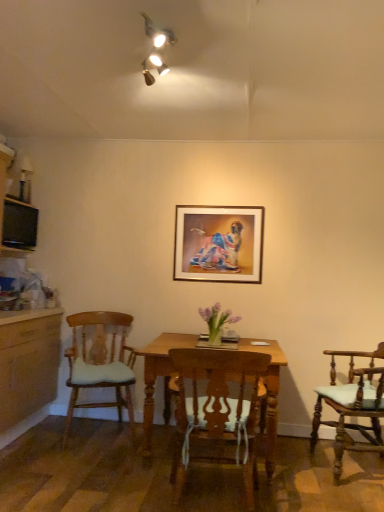
Question: Is gold-framed picture at center not within wooden chair with cushion at right, acting as the third chair starting from the left?

Choices:
 (A) no
 (B) yes

Answer: (B)

Question: Is wooden chair with cushion at right, which is the 1th chair from right to left, surrounded by gold-framed picture at center?

Choices:
 (A) yes
 (B) no

Answer: (B)

Question: Can you confirm if gold-framed picture at center is smaller than wooden chair with cushion at right, which is the 1th chair from right to left?

Choices:
 (A) no
 (B) yes

Answer: (B)

Question: Considering the relative sizes of gold-framed picture at center and wooden chair with cushion at right, acting as the third chair starting from the left, in the image provided, is gold-framed picture at center thinner than wooden chair with cushion at right, acting as the third chair starting from the left,?

Choices:
 (A) no
 (B) yes

Answer: (B)

Question: Does gold-framed picture at center have a lesser height compared to wooden chair with cushion at right, acting as the third chair starting from the left?

Choices:
 (A) no
 (B) yes

Answer: (B)

Question: Is gold-framed picture at center further to camera compared to wooden chair with cushion at right, which is the 1th chair from right to left?

Choices:
 (A) yes
 (B) no

Answer: (A)

Question: From a real-world perspective, is black glossy television at left positioned over gold-framed picture at center based on gravity?

Choices:
 (A) yes
 (B) no

Answer: (A)

Question: Is gold-framed picture at center a part of black glossy television at left?

Choices:
 (A) yes
 (B) no

Answer: (B)

Question: Is black glossy television at left smaller than gold-framed picture at center?

Choices:
 (A) yes
 (B) no

Answer: (B)

Question: Is black glossy television at left to the right of gold-framed picture at center from the viewer's perspective?

Choices:
 (A) no
 (B) yes

Answer: (A)

Question: Is black glossy television at left in front of gold-framed picture at center?

Choices:
 (A) yes
 (B) no

Answer: (A)

Question: Does black glossy television at left have a greater height compared to gold-framed picture at center?

Choices:
 (A) no
 (B) yes

Answer: (A)

Question: Does wooden chair with cushion at right, acting as the third chair starting from the left, appear on the left side of wooden chair with cushion at left, arranged as the third chair when viewed from the right?

Choices:
 (A) no
 (B) yes

Answer: (A)